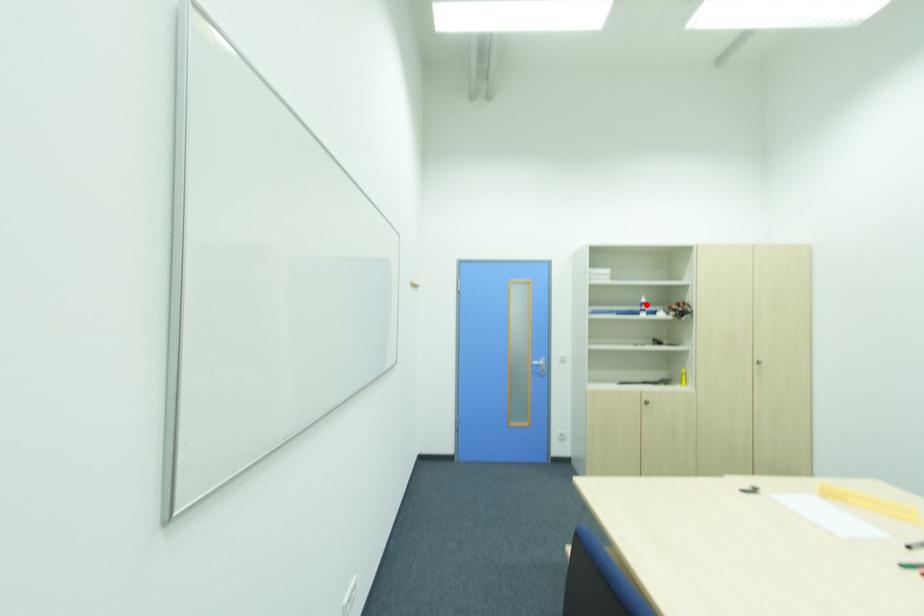
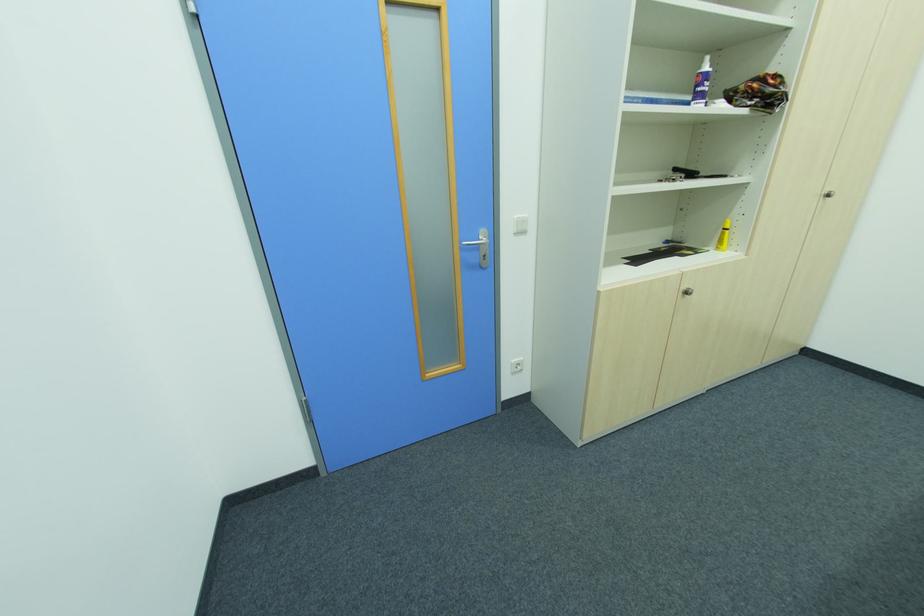
Find the pixel in the second image that matches the highlighted location in the first image.

(708, 78)